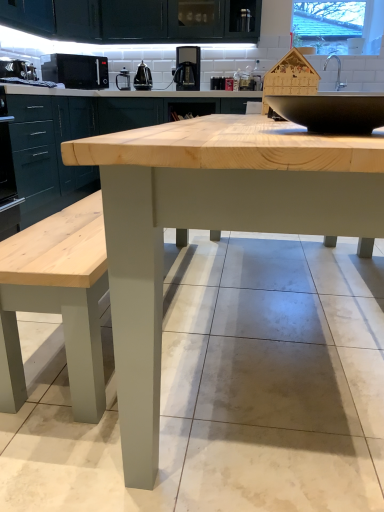
Question: Considering the positions of black matte microwave at upper left, acting as the 2th appliance starting from the left, and matte black coffee maker at upper center, the first appliance when ordered from back to front, in the image, is black matte microwave at upper left, acting as the 2th appliance starting from the left, wider or thinner than matte black coffee maker at upper center, the first appliance when ordered from back to front,?

Choices:
 (A) thin
 (B) wide

Answer: (B)

Question: Is black matte microwave at upper left, which is counted as the 2th appliance, starting from the front, bigger or smaller than matte black coffee maker at upper center, marked as the second appliance in a right-to-left arrangement?

Choices:
 (A) small
 (B) big

Answer: (B)

Question: Which of these objects is positioned closest to the satin black kettle at upper center, the second appliance when ordered from back to front?

Choices:
 (A) matte black coffee maker at upper center, arranged as the fourth appliance when viewed from the front
 (B) black matte microwave at upper left, acting as the fourth appliance starting from the back
 (C) green matte cabinet at center, which is counted as the second cabinetry, starting from the left
 (D) transparent glass window at upper right
 (E) natural wood table at center

Answer: (A)

Question: Which object is the closest to the black matte microwave at upper left, the third appliance in the back-to-front sequence?

Choices:
 (A) satin black coffee machine at upper center
 (B) black matte microwave at upper left, placed as the 4th appliance when sorted from right to left
 (C) natural wood table at center
 (D) transparent glass window at upper right
 (E) green matte cabinet at center, the 1th cabinetry from the right

Answer: (E)